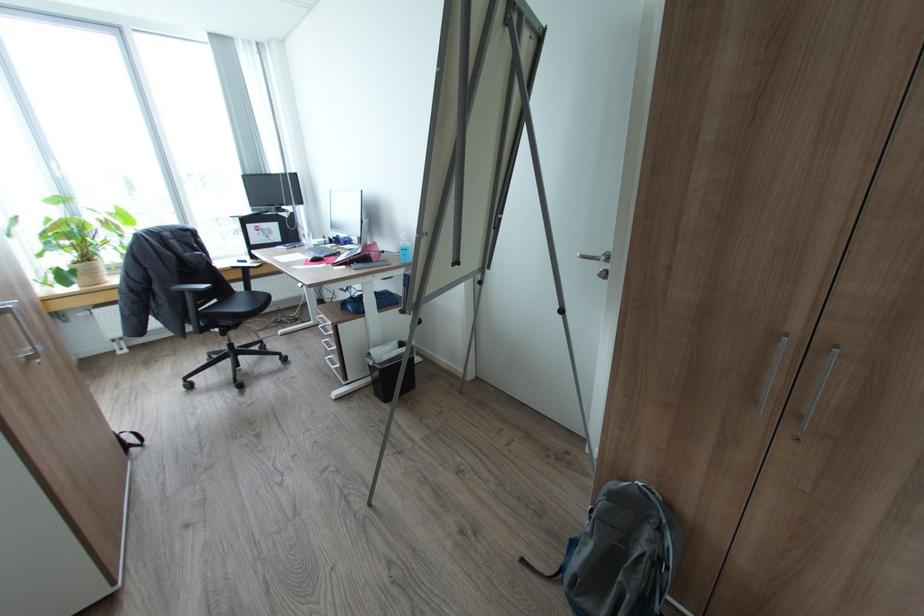
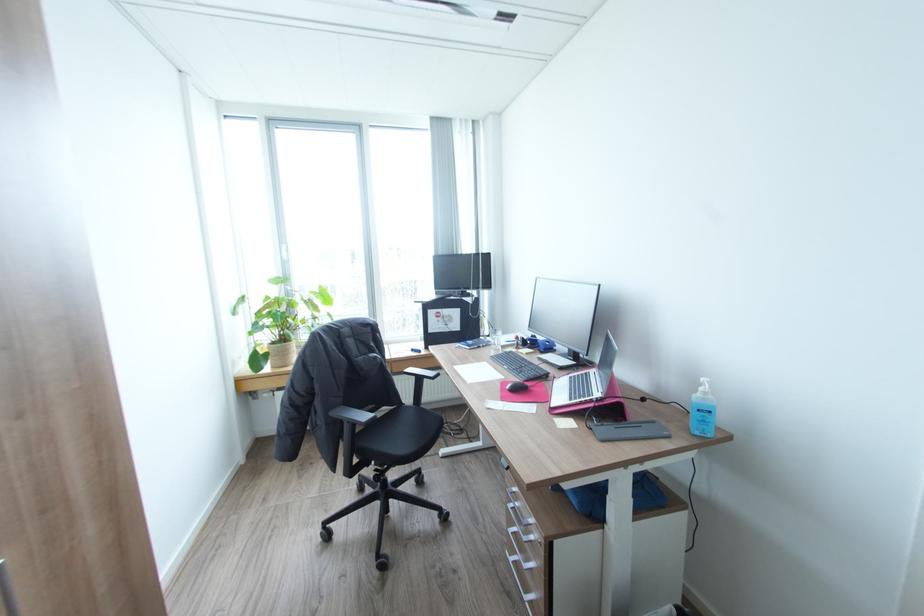
Find the pixel in the second image that matches [246,292] in the first image.

(412, 407)